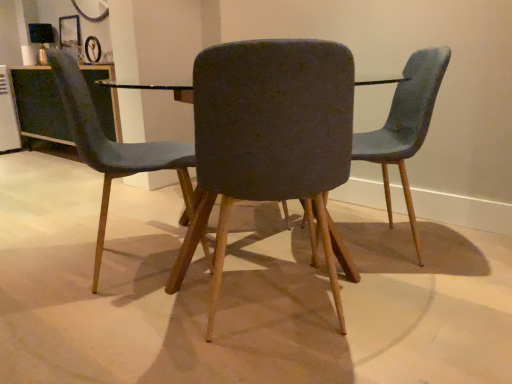
Measure the distance between matte black table at center and camera.

matte black table at center is 9.58 feet away from camera.

In order to click on white plastic appliance at left in this screenshot , I will do `click(8, 115)`.

You are a GUI agent. You are given a task and a screenshot of the screen. Output one action in this format:
    pyautogui.click(x=<x>, y=<y>)
    Task: Click on the textured gray chair at center, placed as the 1th chair when sorted from right to left
    This screenshot has width=512, height=384.
    Given the screenshot: What is the action you would take?
    pyautogui.click(x=405, y=125)

This screenshot has height=384, width=512. What do you see at coordinates (269, 137) in the screenshot? I see `textured gray chair at center, which is the second chair from right to left` at bounding box center [269, 137].

Measure the distance between point (309, 81) and camera.

3.45 feet.

What are the coordinates of `matte black table at center` in the screenshot? It's located at (154, 89).

Is textured gray chair at center, placed as the 1th chair when sorted from right to left, with velvet blue chair at left, the 1th chair in the left-to-right sequence?

No, textured gray chair at center, placed as the 1th chair when sorted from right to left, is not with velvet blue chair at left, the 1th chair in the left-to-right sequence.

Between textured gray chair at center, placed as the 3th chair when sorted from left to right, and velvet blue chair at left, the 1th chair in the left-to-right sequence, which one has more height?

velvet blue chair at left, the 1th chair in the left-to-right sequence.

Would you say textured gray chair at center, placed as the 1th chair when sorted from right to left, is to the left or to the right of velvet blue chair at left, which appears as the third chair when viewed from the right, in the picture?

From the image, it's evident that textured gray chair at center, placed as the 1th chair when sorted from right to left, is to the right of velvet blue chair at left, which appears as the third chair when viewed from the right.

From the image's perspective, which is below, textured gray chair at center, placed as the 3th chair when sorted from left to right, or velvet blue chair at left, the 1th chair in the left-to-right sequence?

velvet blue chair at left, the 1th chair in the left-to-right sequence, is shown below in the image.

Looking at the image, does textured gray chair at center, placed as the 1th chair when sorted from right to left, seem bigger or smaller compared to matte black table at center?

Considering their sizes, textured gray chair at center, placed as the 1th chair when sorted from right to left, takes up less space than matte black table at center.

Is the position of textured gray chair at center, placed as the 1th chair when sorted from right to left, less distant than that of matte black table at center?

No, it is behind matte black table at center.

From the picture: From a real-world perspective, is textured gray chair at center, placed as the 3th chair when sorted from left to right, located beneath matte black table at center?

No, from a real-world perspective, textured gray chair at center, placed as the 3th chair when sorted from left to right, is not beneath matte black table at center.

Which is less distant, (353, 135) or (325, 254)?

Point (353, 135) is closer to the camera than point (325, 254).

From the image's perspective, which object appears higher, textured gray chair at center, placed as the 3th chair when sorted from left to right, or textured gray chair at center, which is the second chair from right to left?

textured gray chair at center, placed as the 3th chair when sorted from left to right.

There is a textured gray chair at center, placed as the 3th chair when sorted from left to right. Where is `the 2nd chair below it (from the image's perspective)`? This screenshot has width=512, height=384. the 2nd chair below it (from the image's perspective) is located at coordinates [x=269, y=137].

Is textured gray chair at center, placed as the 3th chair when sorted from left to right, looking in the opposite direction of textured gray chair at center, which appears as the second chair when viewed from the left?

textured gray chair at center, placed as the 3th chair when sorted from left to right, does not have its back to textured gray chair at center, which appears as the second chair when viewed from the left.

Which of these two, clear glass table at upper left or white plastic appliance at left, stands taller?

white plastic appliance at left.

Between point (26, 89) and point (18, 137), which one is positioned in front?

Point (26, 89)

Does clear glass table at upper left have a smaller size compared to white plastic appliance at left?

Actually, clear glass table at upper left might be larger than white plastic appliance at left.

Is clear glass table at upper left not near white plastic appliance at left?

That's not correct — clear glass table at upper left is a little close to white plastic appliance at left.

Who is more distant, white plastic appliance at left or velvet blue chair at left, which appears as the third chair when viewed from the right?

Positioned behind is white plastic appliance at left.

From the white plastic appliance at left, count 2nd chairs forward and point to it. Please provide its 2D coordinates.

[(113, 145)]

Considering the sizes of objects white plastic appliance at left and velvet blue chair at left, which appears as the third chair when viewed from the right, in the image provided, who is shorter, white plastic appliance at left or velvet blue chair at left, which appears as the third chair when viewed from the right,?

white plastic appliance at left.

Find the location of a particular element. the 2nd chair counting from the right side of the white plastic appliance at left is located at coordinates (269, 137).

Can you confirm if white plastic appliance at left is thinner than textured gray chair at center, which appears as the second chair when viewed from the left?

Yes, white plastic appliance at left is thinner than textured gray chair at center, which appears as the second chair when viewed from the left.

From the image's perspective, does white plastic appliance at left appear higher than textured gray chair at center, which is the second chair from right to left?

Yes.

Is white plastic appliance at left taller than textured gray chair at center, which appears as the second chair when viewed from the left?

No.

Who is bigger, velvet blue chair at left, the 1th chair in the left-to-right sequence, or white plastic appliance at left?

Bigger between the two is velvet blue chair at left, the 1th chair in the left-to-right sequence.

Is white plastic appliance at left a part of velvet blue chair at left, which appears as the third chair when viewed from the right?

No, white plastic appliance at left is not a part of velvet blue chair at left, which appears as the third chair when viewed from the right.

Can you confirm if velvet blue chair at left, the 1th chair in the left-to-right sequence, is shorter than white plastic appliance at left?

No, velvet blue chair at left, the 1th chair in the left-to-right sequence, is not shorter than white plastic appliance at left.

Could you tell me if velvet blue chair at left, the 1th chair in the left-to-right sequence, is turned towards white plastic appliance at left?

No, velvet blue chair at left, the 1th chair in the left-to-right sequence, is not aimed at white plastic appliance at left.

You are a GUI agent. You are given a task and a screenshot of the screen. Output one action in this format:
    pyautogui.click(x=<x>, y=<y>)
    Task: Click on the chair behind the velvet blue chair at left, which appears as the third chair when viewed from the right
    The width and height of the screenshot is (512, 384).
    Given the screenshot: What is the action you would take?
    pyautogui.click(x=405, y=125)

What are the coordinates of `round table that is on the left side of textured gray chair at center, placed as the 3th chair when sorted from left to right` in the screenshot? It's located at (154, 89).

When comparing their distances from white plastic appliance at left, does matte black table at center or textured gray chair at center, placed as the 3th chair when sorted from left to right, seem further?

textured gray chair at center, placed as the 3th chair when sorted from left to right.

Based on their spatial positions, is white plastic appliance at left or matte black table at center further from clear glass table at upper left?

matte black table at center is further to clear glass table at upper left.

From the image, which object appears to be nearer to velvet blue chair at left, which appears as the third chair when viewed from the right, white plastic appliance at left or matte black table at center?

matte black table at center is positioned closer to the anchor velvet blue chair at left, which appears as the third chair when viewed from the right.

Based on their spatial positions, is textured gray chair at center, placed as the 3th chair when sorted from left to right, or clear glass table at upper left further from white plastic appliance at left?

The object further to white plastic appliance at left is textured gray chair at center, placed as the 3th chair when sorted from left to right.

Considering their positions, is clear glass table at upper left positioned further to textured gray chair at center, placed as the 1th chair when sorted from right to left, than white plastic appliance at left?

white plastic appliance at left is further to textured gray chair at center, placed as the 1th chair when sorted from right to left.

Considering their positions, is matte black table at center positioned further to velvet blue chair at left, which appears as the third chair when viewed from the right, than textured gray chair at center, which appears as the second chair when viewed from the left?

matte black table at center is positioned further to the anchor velvet blue chair at left, which appears as the third chair when viewed from the right.

Based on their spatial positions, is textured gray chair at center, which appears as the second chair when viewed from the left, or clear glass table at upper left further from velvet blue chair at left, the 1th chair in the left-to-right sequence?

clear glass table at upper left.

Which object lies nearer to the anchor point textured gray chair at center, which appears as the second chair when viewed from the left, matte black table at center or white plastic appliance at left?

matte black table at center.

Locate an element on the screen. round table located between textured gray chair at center, which appears as the second chair when viewed from the left, and textured gray chair at center, placed as the 1th chair when sorted from right to left, in the depth direction is located at coordinates (154, 89).

Where is `table between matte black table at center and white plastic appliance at left in the front-back direction`? table between matte black table at center and white plastic appliance at left in the front-back direction is located at coordinates (39, 105).

Find the location of `round table located between white plastic appliance at left and textured gray chair at center, placed as the 1th chair when sorted from right to left, in the left-right direction`. round table located between white plastic appliance at left and textured gray chair at center, placed as the 1th chair when sorted from right to left, in the left-right direction is located at coordinates click(x=154, y=89).

At what (x,y) coordinates should I click in order to perform the action: click on table between textured gray chair at center, which is the second chair from right to left, and white plastic appliance at left from front to back. Please return your answer as a coordinate pair (x, y). The image size is (512, 384). Looking at the image, I should click on (39, 105).